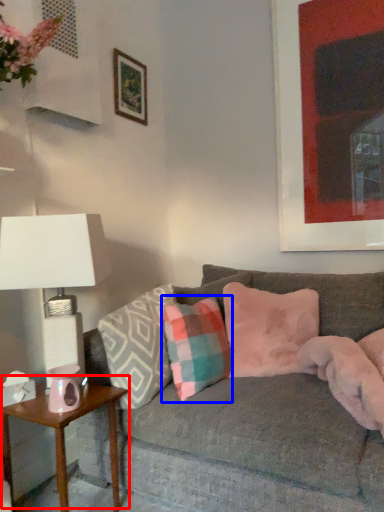
Question: Which object appears closest to the camera in this image, table (highlighted by a red box) or pillow (highlighted by a blue box)?

Choices:
 (A) table
 (B) pillow

Answer: (A)